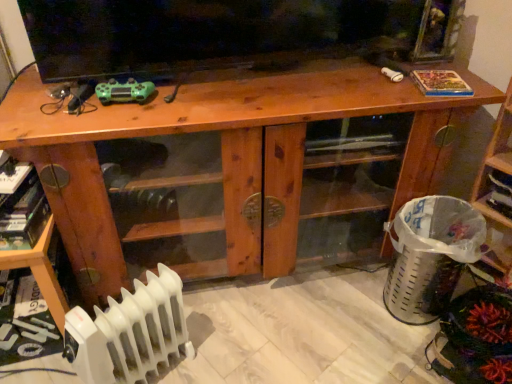
At what (x,y) coordinates should I click in order to perform the action: click on green matte controller at upper left. Please return your answer as a coordinate pair (x, y). Image resolution: width=512 pixels, height=384 pixels. Looking at the image, I should click on (124, 91).

Measure the distance between point (81, 320) and camera.

They are 1.00 meters apart.

Locate an element on the screen. white plastic radiator at lower left is located at coordinates (130, 332).

Where is `wooden shelf at right, acting as the 2th shelf starting from the left`? The image size is (512, 384). wooden shelf at right, acting as the 2th shelf starting from the left is located at coordinates (497, 199).

In order to face wooden shelf at lower left, marked as the 2th shelf in a right-to-left arrangement, should I rotate leftwards or rightwards?

You should look left and rotate roughly 28.677 degrees.

Image resolution: width=512 pixels, height=384 pixels. I want to click on wooden cabinet at center, so click(x=222, y=161).

This screenshot has width=512, height=384. Identify the location of matte black tv at upper center. (229, 34).

Which is farther from the camera, (x=497, y=240) or (x=45, y=238)?

The point (x=497, y=240) is farther from the camera.

How many degrees apart are the facing directions of wooden shelf at right, acting as the 2th shelf starting from the left, and wooden shelf at lower left, marked as the 2th shelf in a right-to-left arrangement?

The angle between the facing direction of wooden shelf at right, acting as the 2th shelf starting from the left, and the facing direction of wooden shelf at lower left, marked as the 2th shelf in a right-to-left arrangement, is 66.3 degrees.

Consider the image. Is wooden shelf at right, acting as the 2th shelf starting from the left, in front of wooden shelf at lower left, the 1th shelf from the left?

Yes, the depth of wooden shelf at right, acting as the 2th shelf starting from the left, is less than that of wooden shelf at lower left, the 1th shelf from the left.

From the image's perspective, is wooden shelf at right, the 1th shelf viewed from the right, above or below wooden shelf at lower left, marked as the 2th shelf in a right-to-left arrangement?

wooden shelf at right, the 1th shelf viewed from the right, is above wooden shelf at lower left, marked as the 2th shelf in a right-to-left arrangement.

How many degrees apart are the facing directions of matte black tv at upper center and white plastic radiator at lower left?

The angular difference between matte black tv at upper center and white plastic radiator at lower left is 33.5 degrees.

Would you say white plastic radiator at lower left is part of matte black tv at upper center's contents?

No, matte black tv at upper center does not contain white plastic radiator at lower left.

Is white plastic radiator at lower left at the back of matte black tv at upper center?

No, matte black tv at upper center is not facing away from white plastic radiator at lower left.

Does point (35, 4) come behind point (155, 294)?

No.

Is wooden cabinet at center behind white plastic radiator at lower left?

Yes.

Which is closer to the camera, (38, 146) or (182, 337)?

The point (38, 146) is in front.

Can white plastic radiator at lower left be found inside wooden cabinet at center?

Definitely not — white plastic radiator at lower left is not inside wooden cabinet at center.

How distant is wooden cabinet at center from wooden shelf at lower left, marked as the 2th shelf in a right-to-left arrangement?

18.64 inches.

Is the surface of wooden cabinet at center in direct contact with wooden shelf at lower left, the 1th shelf from the left?

No, wooden cabinet at center is not with wooden shelf at lower left, the 1th shelf from the left.

Is wooden cabinet at center oriented towards wooden shelf at lower left, marked as the 2th shelf in a right-to-left arrangement?

No, wooden cabinet at center is not oriented towards wooden shelf at lower left, marked as the 2th shelf in a right-to-left arrangement.

Which point is more forward, (11, 91) or (49, 293)?

The point (49, 293) is closer.

Is wooden shelf at right, the 1th shelf viewed from the right, aimed at green matte controller at upper left?

No, wooden shelf at right, the 1th shelf viewed from the right, does not turn towards green matte controller at upper left.

From a real-world perspective, which object rests below the other?

wooden shelf at right, acting as the 2th shelf starting from the left, from a real-world perspective.

From their relative heights in the image, would you say wooden shelf at right, the 1th shelf viewed from the right, is taller or shorter than green matte controller at upper left?

In the image, wooden shelf at right, the 1th shelf viewed from the right, appears to be taller than green matte controller at upper left.

Are wooden shelf at lower left, marked as the 2th shelf in a right-to-left arrangement, and white plastic radiator at lower left located far from each other?

Actually, wooden shelf at lower left, marked as the 2th shelf in a right-to-left arrangement, and white plastic radiator at lower left are a little close together.

Considering the relative sizes of wooden shelf at lower left, marked as the 2th shelf in a right-to-left arrangement, and white plastic radiator at lower left in the image provided, is wooden shelf at lower left, marked as the 2th shelf in a right-to-left arrangement, taller than white plastic radiator at lower left?

No.

Can you confirm if wooden shelf at lower left, marked as the 2th shelf in a right-to-left arrangement, is positioned to the left of white plastic radiator at lower left?

Indeed, wooden shelf at lower left, marked as the 2th shelf in a right-to-left arrangement, is positioned on the left side of white plastic radiator at lower left.

Considering the relative sizes of wooden shelf at lower left, the 1th shelf from the left, and white plastic radiator at lower left in the image provided, is wooden shelf at lower left, the 1th shelf from the left, thinner than white plastic radiator at lower left?

In fact, wooden shelf at lower left, the 1th shelf from the left, might be wider than white plastic radiator at lower left.

Which is more to the left, matte black tv at upper center or green matte controller at upper left?

green matte controller at upper left is more to the left.

Which point is more distant from viewer, (366, 45) or (120, 100)?

The point (366, 45) is behind.

Is matte black tv at upper center thinner than green matte controller at upper left?

No.

From a real-world perspective, between matte black tv at upper center and green matte controller at upper left, who is vertically lower?

From a 3D spatial view, green matte controller at upper left is below.

This screenshot has height=384, width=512. In order to click on shelf to the left of wooden shelf at right, the 1th shelf viewed from the right in this screenshot , I will do `click(40, 271)`.

This screenshot has width=512, height=384. Identify the location of television that is on the right side of white plastic radiator at lower left. 229,34.

When comparing their distances from matte black tv at upper center, does wooden shelf at right, the 1th shelf viewed from the right, or wooden cabinet at center seem further?

wooden shelf at right, the 1th shelf viewed from the right, is positioned further to the anchor matte black tv at upper center.

Considering their positions, is white plastic radiator at lower left positioned closer to matte black tv at upper center than green matte controller at upper left?

green matte controller at upper left is closer to matte black tv at upper center.

Which object lies nearer to the anchor point wooden shelf at lower left, the 1th shelf from the left, wooden shelf at right, the 1th shelf viewed from the right, or green matte controller at upper left?

green matte controller at upper left is positioned closer to the anchor wooden shelf at lower left, the 1th shelf from the left.

Which object lies further to the anchor point matte black tv at upper center, wooden shelf at right, the 1th shelf viewed from the right, or green matte controller at upper left?

wooden shelf at right, the 1th shelf viewed from the right, lies further to matte black tv at upper center than the other object.

When comparing their distances from wooden shelf at right, acting as the 2th shelf starting from the left, does wooden cabinet at center or green matte controller at upper left seem further?

green matte controller at upper left is positioned further to the anchor wooden shelf at right, acting as the 2th shelf starting from the left.

Considering their positions, is wooden shelf at right, the 1th shelf viewed from the right, positioned further to wooden shelf at lower left, marked as the 2th shelf in a right-to-left arrangement, than matte black tv at upper center?

wooden shelf at right, the 1th shelf viewed from the right, lies further to wooden shelf at lower left, marked as the 2th shelf in a right-to-left arrangement, than the other object.

Which object lies nearer to the anchor point white plastic radiator at lower left, matte black tv at upper center or wooden shelf at lower left, marked as the 2th shelf in a right-to-left arrangement?

The object closer to white plastic radiator at lower left is wooden shelf at lower left, marked as the 2th shelf in a right-to-left arrangement.

Based on their spatial positions, is matte black tv at upper center or wooden shelf at right, the 1th shelf viewed from the right, closer to wooden shelf at lower left, the 1th shelf from the left?

Among the two, matte black tv at upper center is located nearer to wooden shelf at lower left, the 1th shelf from the left.

Image resolution: width=512 pixels, height=384 pixels. Find the location of `desk between wooden shelf at lower left, marked as the 2th shelf in a right-to-left arrangement, and wooden shelf at right, acting as the 2th shelf starting from the left, from left to right`. desk between wooden shelf at lower left, marked as the 2th shelf in a right-to-left arrangement, and wooden shelf at right, acting as the 2th shelf starting from the left, from left to right is located at coordinates (222, 161).

Image resolution: width=512 pixels, height=384 pixels. I want to click on toy between wooden shelf at lower left, the 1th shelf from the left, and wooden shelf at right, acting as the 2th shelf starting from the left, from left to right, so click(x=124, y=91).

Locate an element on the screen. This screenshot has height=384, width=512. toy between wooden shelf at lower left, marked as the 2th shelf in a right-to-left arrangement, and wooden cabinet at center is located at coordinates (124, 91).

Where is `radiator located between wooden shelf at lower left, the 1th shelf from the left, and wooden shelf at right, acting as the 2th shelf starting from the left, in the left-right direction`? The image size is (512, 384). radiator located between wooden shelf at lower left, the 1th shelf from the left, and wooden shelf at right, acting as the 2th shelf starting from the left, in the left-right direction is located at coordinates (130, 332).